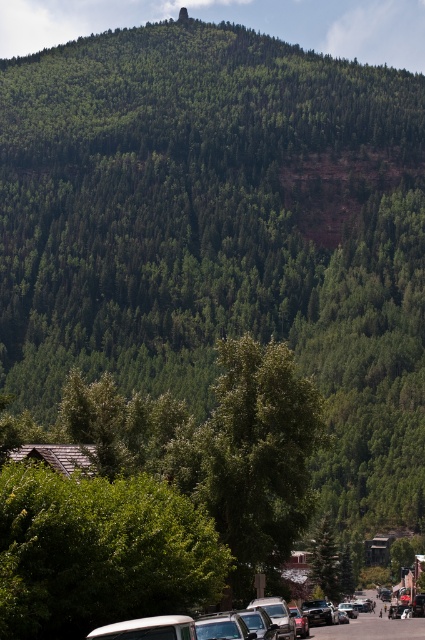
You are standing at the base of the mountain in the town and see two points marked in the image. Which point, point (33, 541) or point (289, 611), is closer to you?

Point (33, 541) is closer to the viewer than point (289, 611).

You are a pedestrian standing on the street and want to take a photo of the mountain. There is a green leafy tree at lower center and a shiny silver sedan at lower center in your way. Which object should you move to get a clear view of the mountain?

The green leafy tree at lower center is not as tall as the shiny silver sedan at lower center, so you should move the shiny silver sedan at lower center to get a clear view of the mountain.